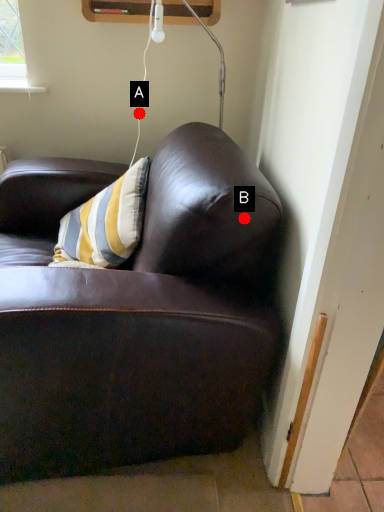
Question: Two points are circled on the image, labeled by A and B beside each circle. Among these points, which one is nearest to the camera?

Choices:
 (A) A is closer
 (B) B is closer

Answer: (B)